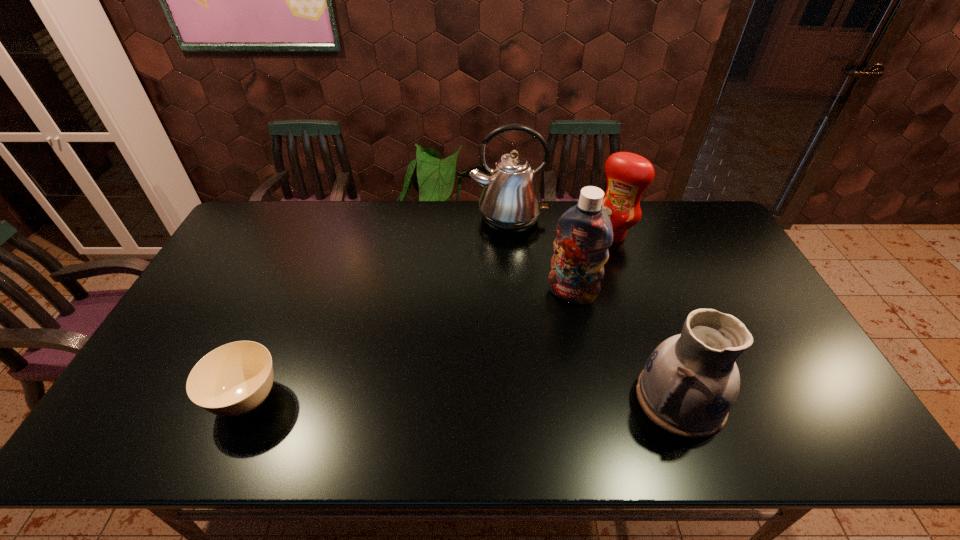
Locate an element on the screen. The width and height of the screenshot is (960, 540). the leftmost object is located at coordinates (233, 379).

Identify the location of the shortest object. The width and height of the screenshot is (960, 540). tap(233, 379).

Where is `pottery`? pottery is located at coordinates (690, 382).

Where is `the third nearest object`? the third nearest object is located at coordinates point(584,232).

At what (x,y) coordinates should I click in order to perform the action: click on kettle. Please return your answer as a coordinate pair (x, y). The image size is (960, 540). Looking at the image, I should click on (510, 202).

Where is `condiment`? This screenshot has width=960, height=540. condiment is located at coordinates (628, 175).

Find the location of a particular element. free spot located 0.310m on the right of the leftmost object is located at coordinates (411, 399).

Locate an element on the screen. The height and width of the screenshot is (540, 960). vacant space located on the left of the pottery is located at coordinates (490, 399).

Locate an element on the screen. This screenshot has height=540, width=960. vacant space located 0.210m on the front label of the shampoo is located at coordinates (540, 357).

Where is `free space located on the front label of the shampoo`? The height and width of the screenshot is (540, 960). free space located on the front label of the shampoo is located at coordinates (528, 381).